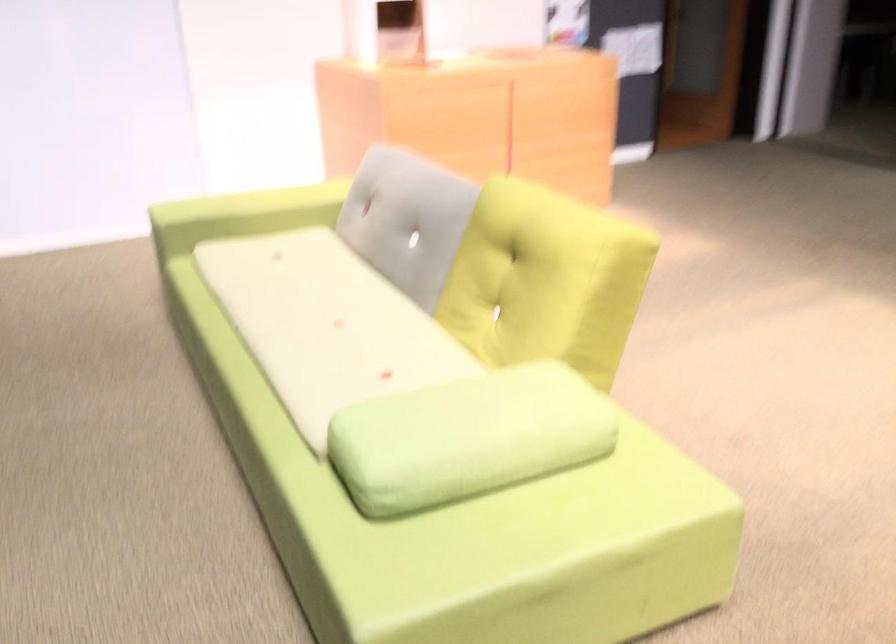
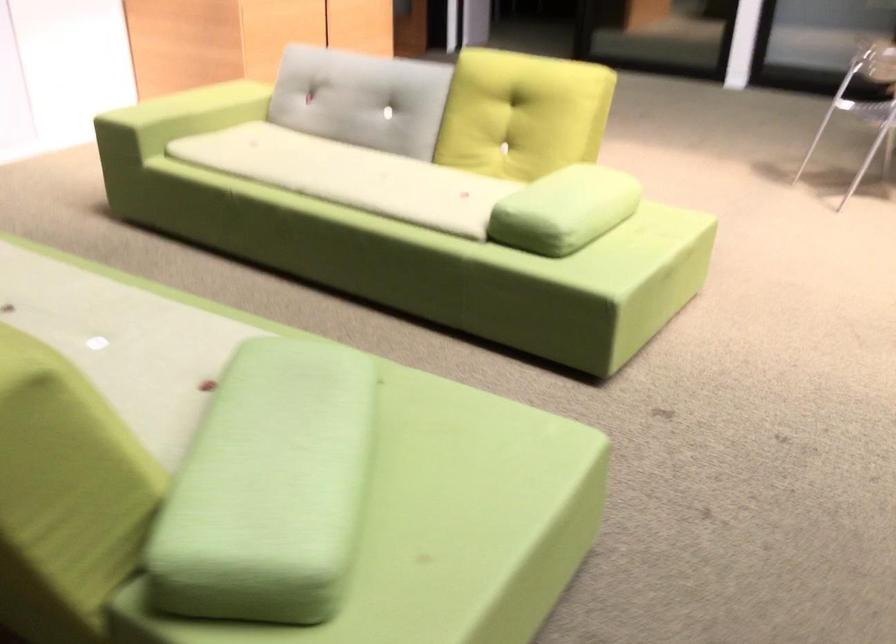
In the second image, find the point that corresponds to (395,449) in the first image.

(564, 210)